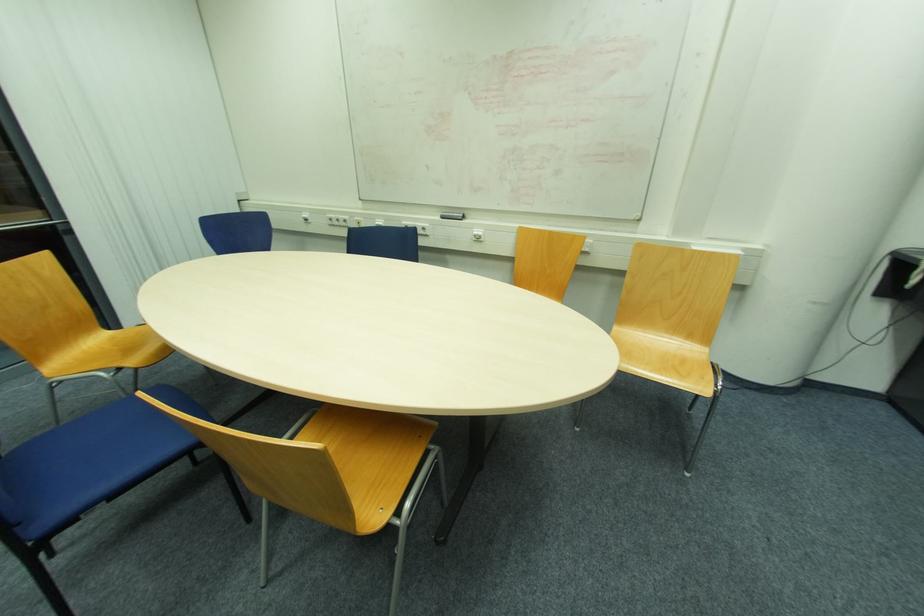
Find the location of a particular element. The height and width of the screenshot is (616, 924). white power outlet is located at coordinates (477, 235).